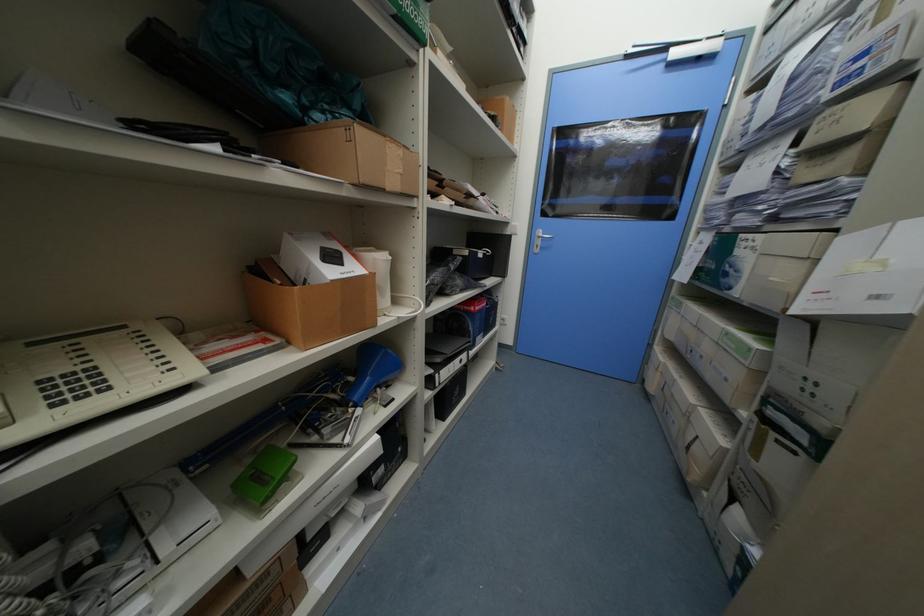
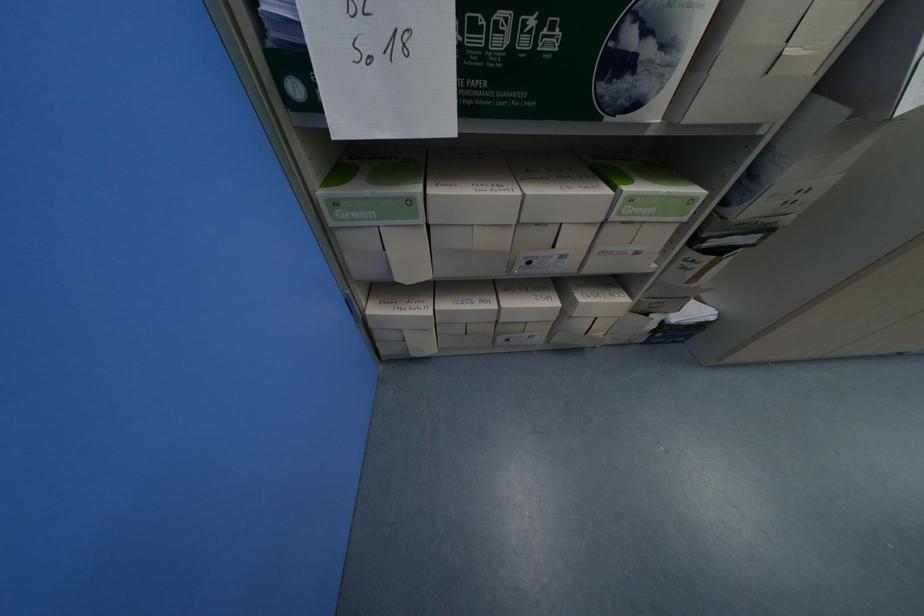
The point at (734, 334) is marked in the first image. Where is the corresponding point in the second image?

(638, 200)